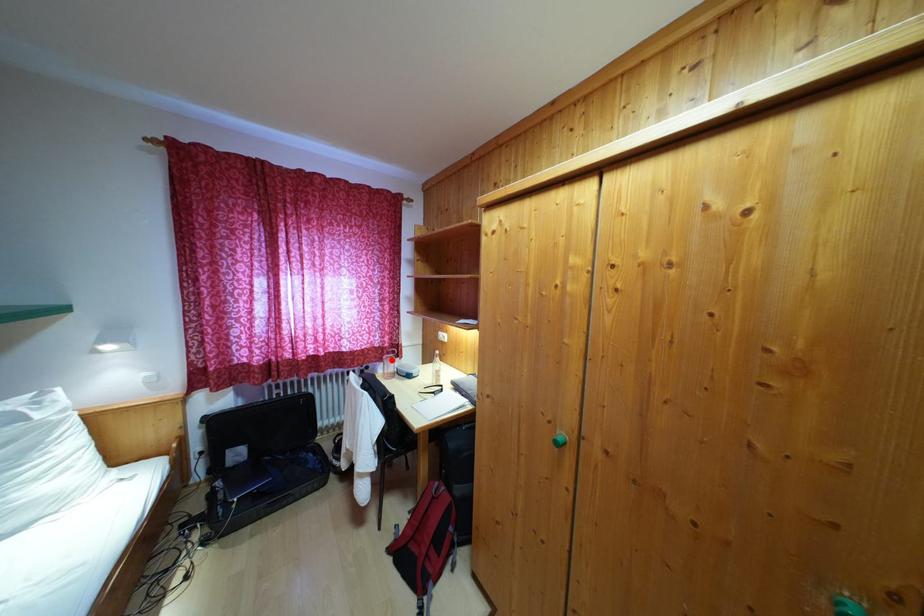
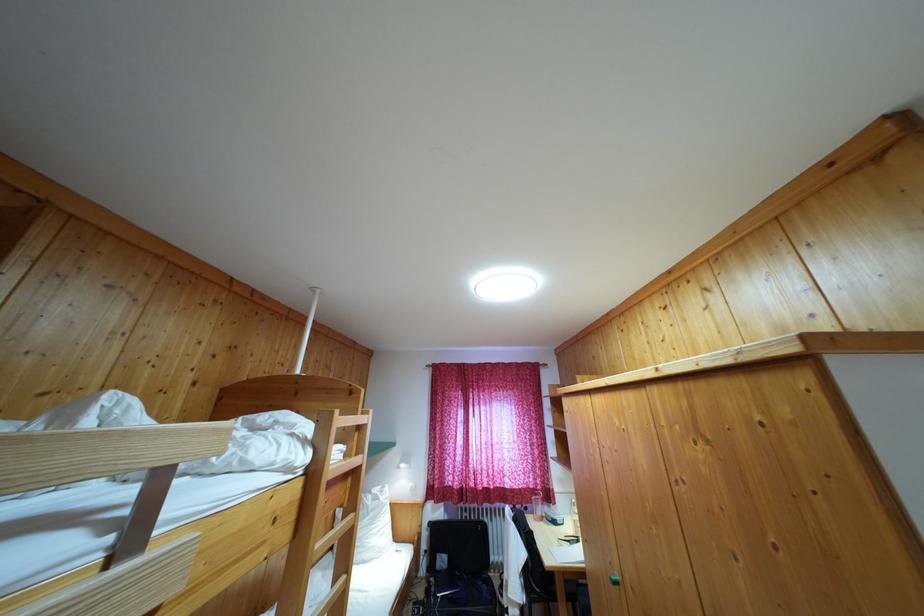
Locate, in the second image, the point that corresponds to the highlighted location in the first image.

(539, 501)